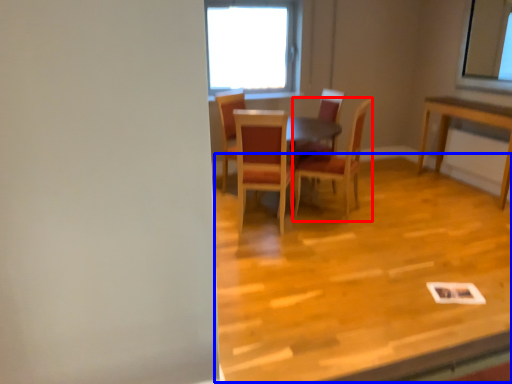
Question: Among these objects, which one is farthest to the camera, chair (highlighted by a red box) or plywood (highlighted by a blue box)?

Choices:
 (A) chair
 (B) plywood

Answer: (A)